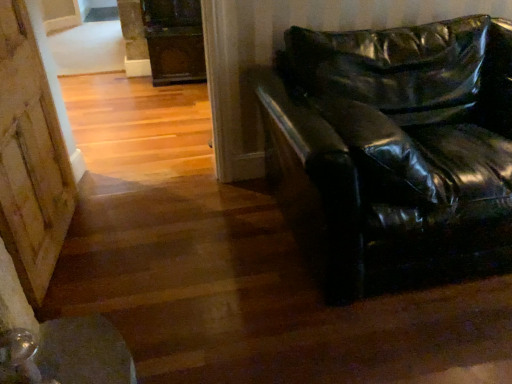
Question: Is glossy black leather couch at right completely or partially inside wooden barn door at lower left?

Choices:
 (A) no
 (B) yes

Answer: (A)

Question: From a real-world perspective, is wooden barn door at lower left positioned over glossy black leather couch at right based on gravity?

Choices:
 (A) no
 (B) yes

Answer: (B)

Question: From a real-world perspective, does wooden barn door at lower left sit lower than glossy black leather couch at right?

Choices:
 (A) yes
 (B) no

Answer: (B)

Question: Could you tell me if wooden barn door at lower left is facing glossy black leather couch at right?

Choices:
 (A) yes
 (B) no

Answer: (A)

Question: Is wooden barn door at lower left oriented away from glossy black leather couch at right?

Choices:
 (A) yes
 (B) no

Answer: (B)

Question: From the image's perspective, does wooden barn door at lower left appear higher than glossy black leather couch at right?

Choices:
 (A) yes
 (B) no

Answer: (B)

Question: Does glossy black leather couch at right have a greater height compared to wooden barn door at lower left?

Choices:
 (A) no
 (B) yes

Answer: (A)

Question: Is glossy black leather couch at right with wooden barn door at lower left?

Choices:
 (A) yes
 (B) no

Answer: (B)

Question: Is glossy black leather couch at right behind wooden barn door at lower left?

Choices:
 (A) no
 (B) yes

Answer: (A)

Question: Would you consider glossy black leather couch at right to be distant from wooden barn door at lower left?

Choices:
 (A) no
 (B) yes

Answer: (B)

Question: Is wooden barn door at lower left inside glossy black leather couch at right?

Choices:
 (A) yes
 (B) no

Answer: (B)

Question: From the image's perspective, does glossy black leather couch at right appear higher than wooden barn door at lower left?

Choices:
 (A) yes
 (B) no

Answer: (A)

Question: Is point click(x=449, y=99) closer or farther from the camera than point click(x=17, y=122)?

Choices:
 (A) farther
 (B) closer

Answer: (A)